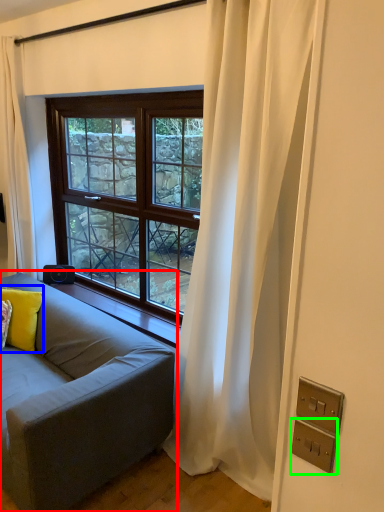
Question: Which object is the closest to the studio couch (highlighted by a red box)? Choose among these: pillow (highlighted by a blue box) or electric outlet (highlighted by a green box).

Choices:
 (A) pillow
 (B) electric outlet

Answer: (A)